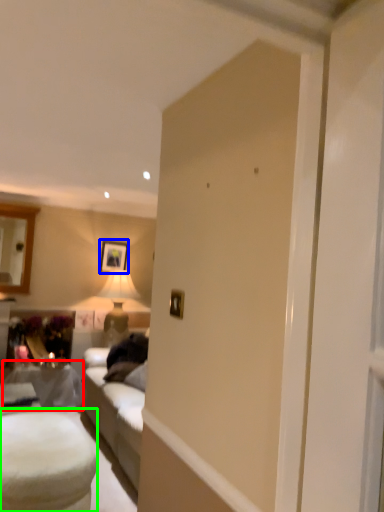
Question: Which object is the farthest from table (highlighted by a red box)? Choose among these: picture frame (highlighted by a blue box) or table (highlighted by a green box).

Choices:
 (A) picture frame
 (B) table

Answer: (A)